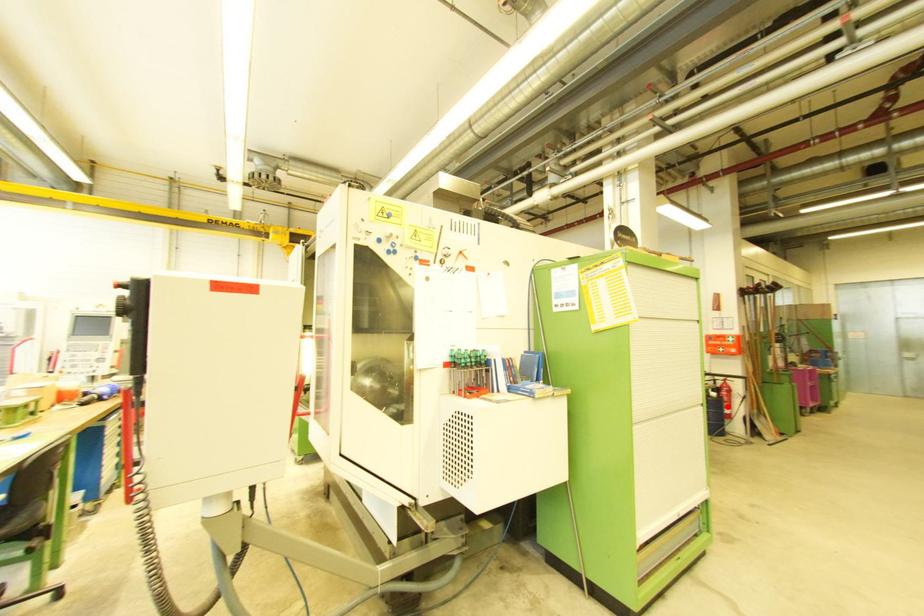
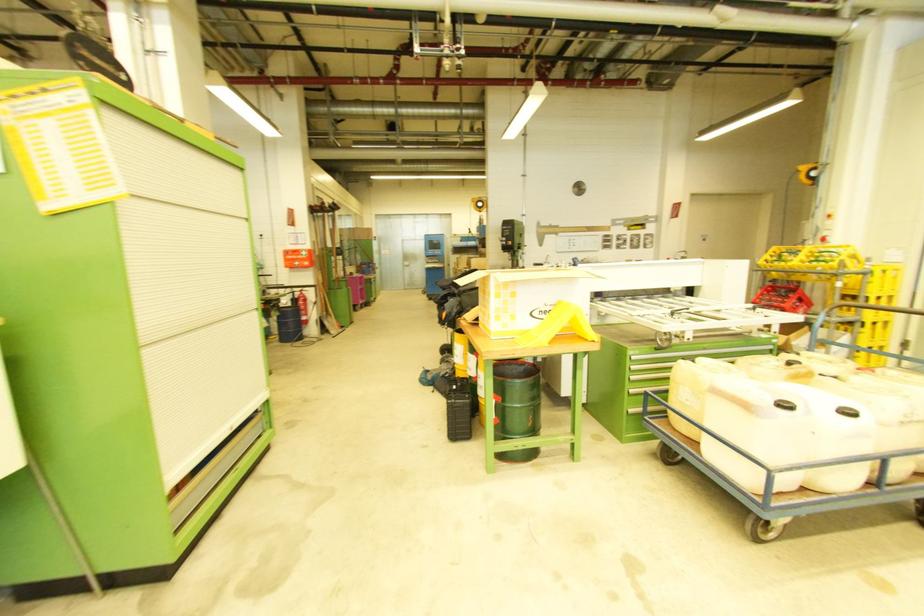
Find the pixel in the second image that matches the highlighted location in the first image.

(306, 314)